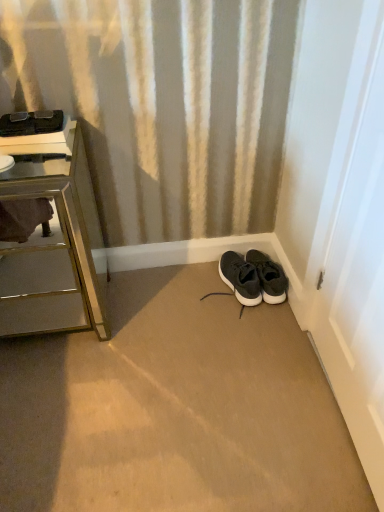
Image resolution: width=384 pixels, height=512 pixels. Identify the location of empty space that is in between metallic mirrored chest of drawers at left and black matte sneakers at lower right. (163, 304).